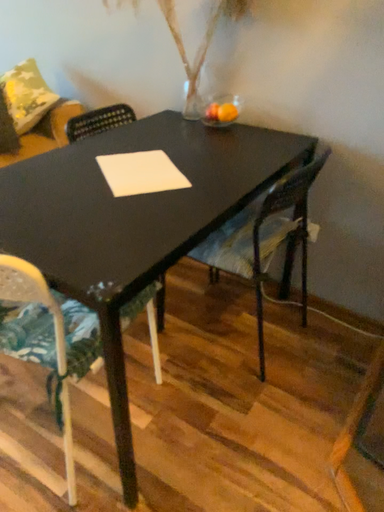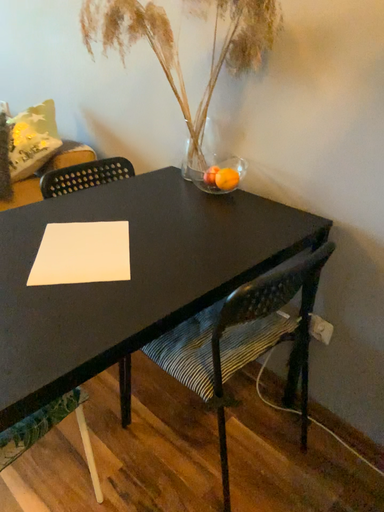
Question: How did the camera likely rotate when shooting the video?

Choices:
 (A) rotated right
 (B) rotated left

Answer: (B)